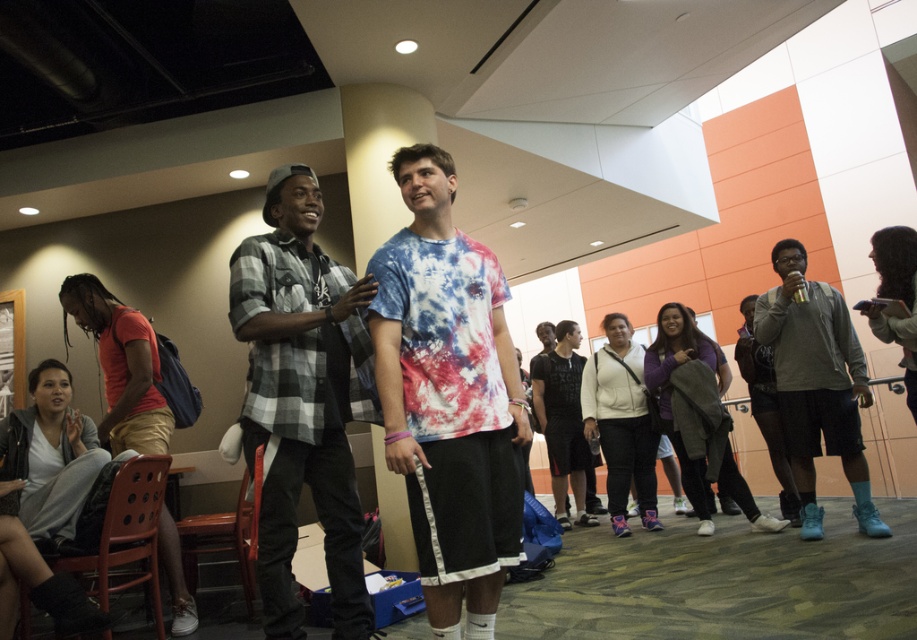
Is tie-dye fabric shirt at center taller than plaid flannel shirt at center?

Incorrect, tie-dye fabric shirt at center's height is not larger of plaid flannel shirt at center's.

Is tie-dye fabric shirt at center wider than plaid flannel shirt at center?

Incorrect, tie-dye fabric shirt at center's width does not surpass plaid flannel shirt at center's.

This screenshot has width=917, height=640. I want to click on tie-dye fabric shirt at center, so click(x=448, y=396).

Who is taller, brown plastic chair at lower left or wooden chair at lower left?

brown plastic chair at lower left is taller.

Consider the image. Is brown plastic chair at lower left shorter than wooden chair at lower left?

Incorrect, brown plastic chair at lower left's height does not fall short of wooden chair at lower left's.

Between point (148, 516) and point (238, 531), which one is positioned in front?

Positioned in front is point (148, 516).

Where is `brown plastic chair at lower left`? Image resolution: width=917 pixels, height=640 pixels. brown plastic chair at lower left is located at coordinates (128, 531).

Which of these two, gray fleece jacket at right or brown wood chair at lower left, stands taller?

gray fleece jacket at right

Between point (825, 412) and point (240, 547), which one is positioned behind?

The point (825, 412) is more distant.

I want to click on gray fleece jacket at right, so click(x=816, y=384).